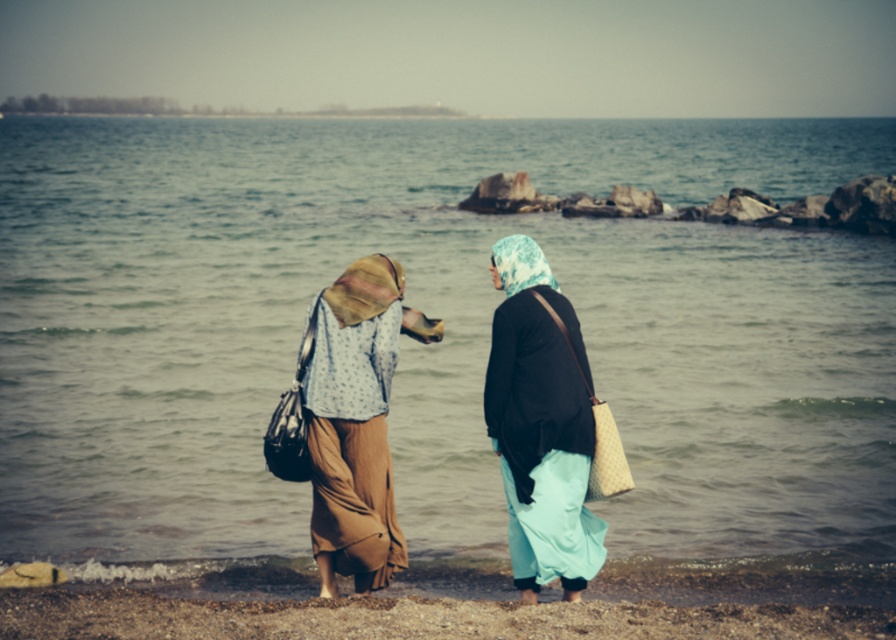
You are standing at the shoreline in the image and want to walk towards the two points marked in the scene. Which point, point (x=492, y=378) or point (x=312, y=433), will you reach first?

Point (x=492, y=378) is closer to the viewer than point (x=312, y=433), so you will reach point (x=492, y=378) first.

Based on the photo, you are a photographer trying to capture a closeup shot of the light blue printed hijab at center and the brown textured skirt at center. Based on the scene, can you fit both subjects into your camera frame without moving the camera? Explain using their spatial relationship.

The light blue printed hijab at center and the brown textured skirt at center are only 30.97 inches apart. Since this distance is relatively small, it is feasible to capture both subjects within the camera frame without moving the camera, provided the lens can accommodate the required field of view.